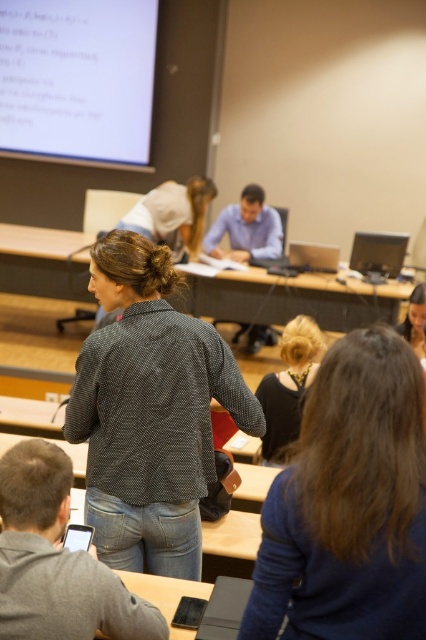
Question: Based on their relative distances, which object is nearer to the patterned fabric shirt at center?

Choices:
 (A) smooth brown hair at upper right
 (B) dark brown hair at center

Answer: (B)

Question: Which of the following is the closest to the observer?

Choices:
 (A) (80, 99)
 (B) (294, 333)
 (C) (411, 330)

Answer: (B)

Question: Considering the relative positions of wooden table at center and dark brown hair at center in the image provided, where is wooden table at center located with respect to dark brown hair at center?

Choices:
 (A) right
 (B) left

Answer: (A)

Question: Estimate the real-world distances between objects in this image. Which object is closer to the patterned fabric shirt at center?

Choices:
 (A) smooth brown hair at upper right
 (B) white matte projector screen at upper left
 (C) dark blue sweater at center

Answer: (C)

Question: Is white matte projector screen at upper left below smooth brown hair at upper right?

Choices:
 (A) no
 (B) yes

Answer: (A)

Question: Does patterned fabric shirt at center come in front of smooth brown hair at upper right?

Choices:
 (A) no
 (B) yes

Answer: (B)